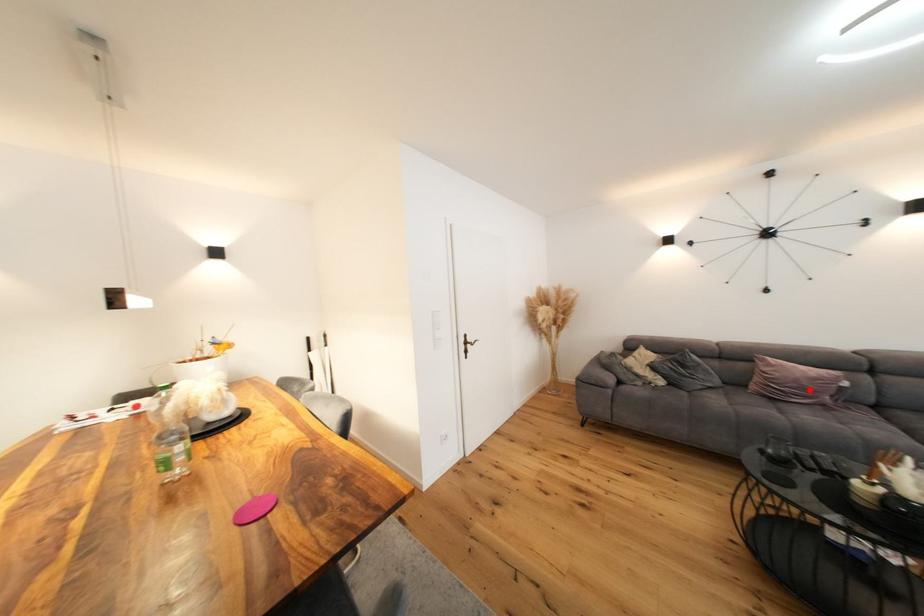
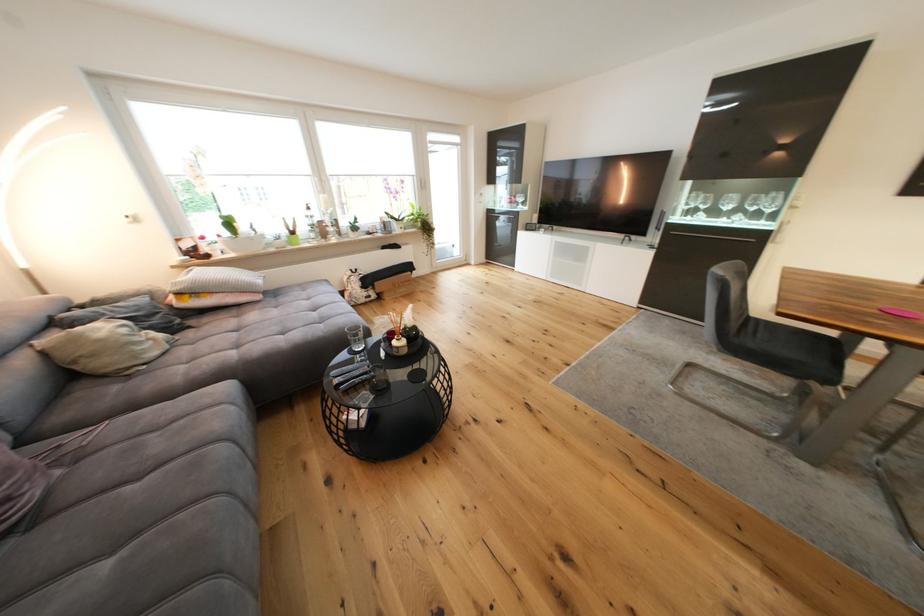
In the second image, find the point that corresponds to the highlighted location in the first image.

(18, 469)